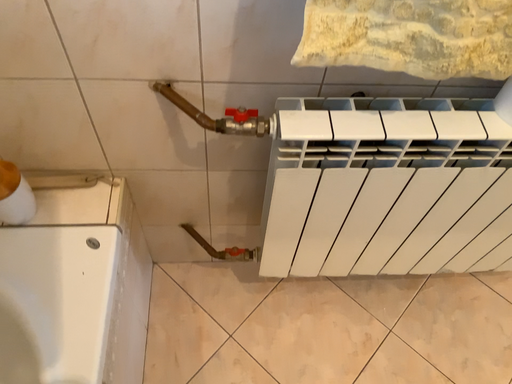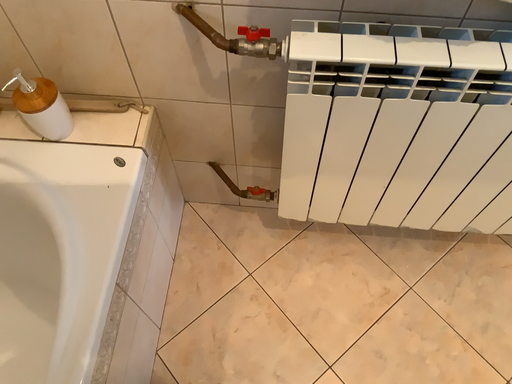
Question: How did the camera likely rotate when shooting the video?

Choices:
 (A) rotated right
 (B) rotated left

Answer: (B)